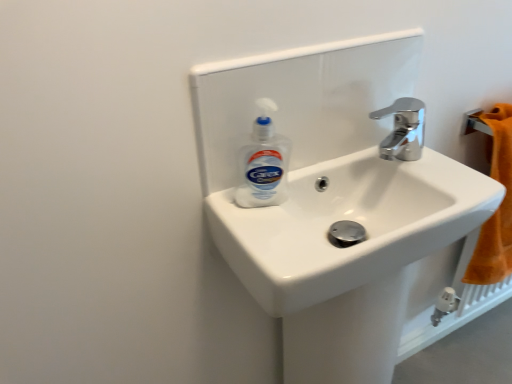
Locate an element on the screen. This screenshot has width=512, height=384. vacant area that is in front of white plastic bottle at center is located at coordinates (273, 233).